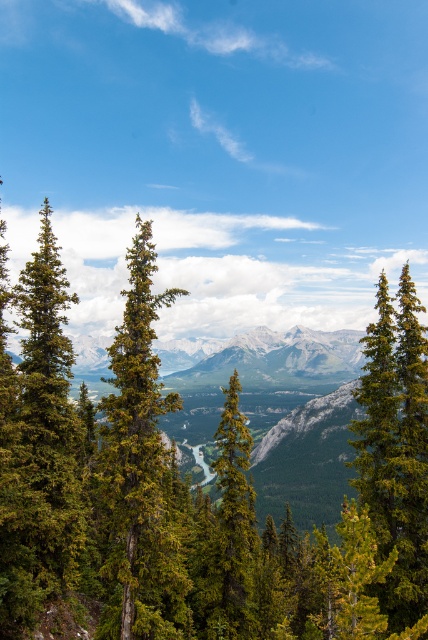
Question: Is green matte evergreen tree at left positioned behind green textured pine tree at center?

Choices:
 (A) yes
 (B) no

Answer: (B)

Question: Which object appears closest to the camera in this image?

Choices:
 (A) green textured tree at center
 (B) green matte evergreen tree at left

Answer: (B)

Question: Which point is farther to the camera?

Choices:
 (A) green evergreen tree at center
 (B) green textured pine tree at center

Answer: (B)

Question: Can you confirm if green matte evergreen tree at left is wider than green textured pine tree at center?

Choices:
 (A) no
 (B) yes

Answer: (A)

Question: Among these objects, which one is nearest to the camera?

Choices:
 (A) green textured pine tree at center
 (B) green matte evergreen tree at left
 (C) green matte tree at right

Answer: (C)

Question: Does green evergreen tree at center appear on the right side of green textured pine tree at center?

Choices:
 (A) no
 (B) yes

Answer: (B)